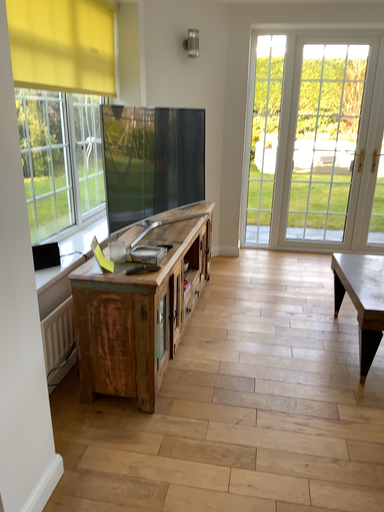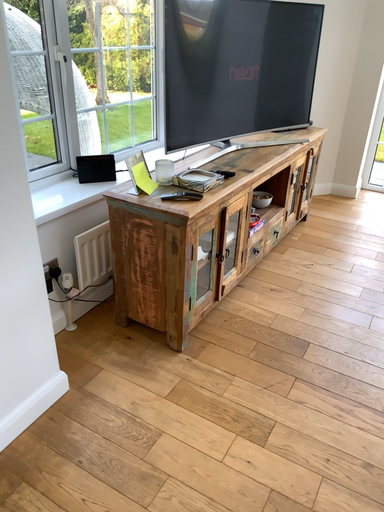
Question: How did the camera likely rotate when shooting the video?

Choices:
 (A) rotated upward
 (B) rotated downward

Answer: (B)